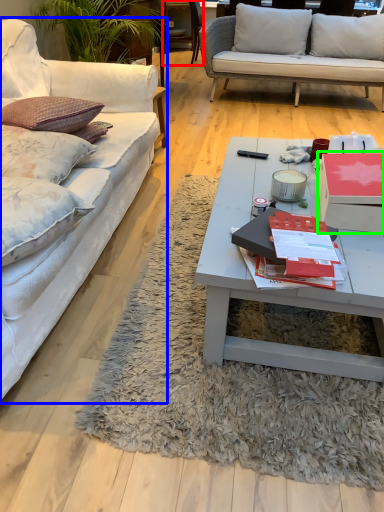
Question: Which is farther away from chair (highlighted by a red box)? studio couch (highlighted by a blue box) or box (highlighted by a green box)?

Choices:
 (A) studio couch
 (B) box

Answer: (B)